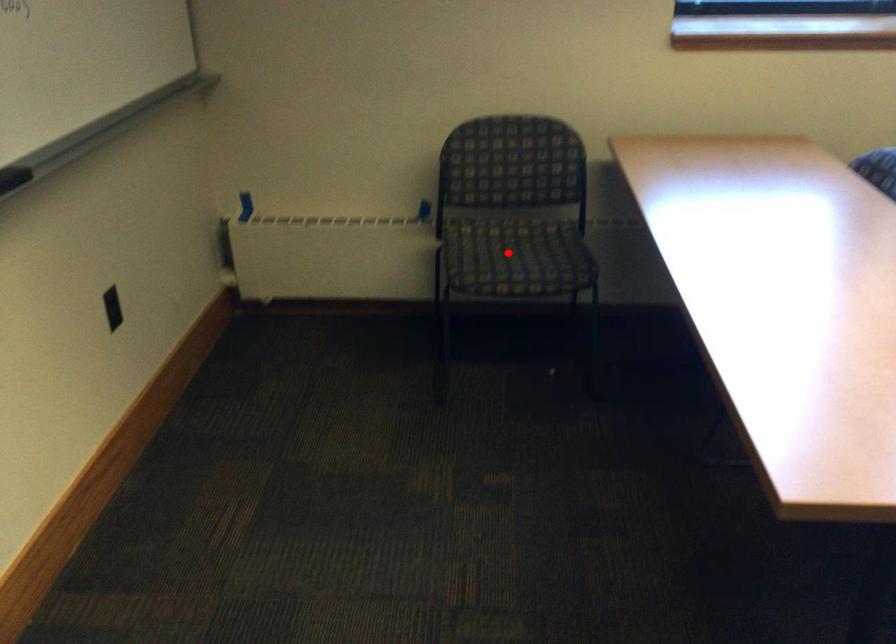
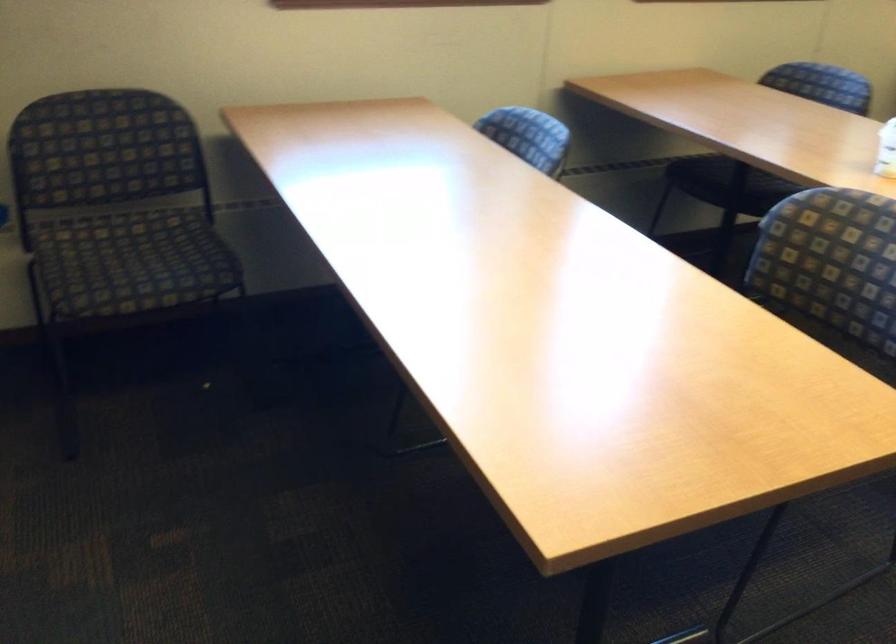
Locate, in the second image, the point that corresponds to the highlighted location in the first image.

(131, 261)